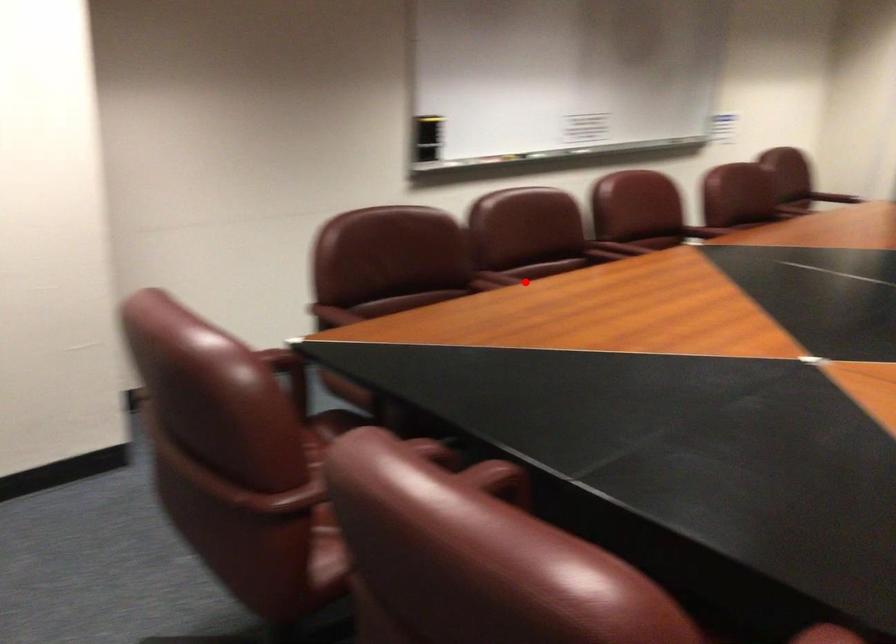
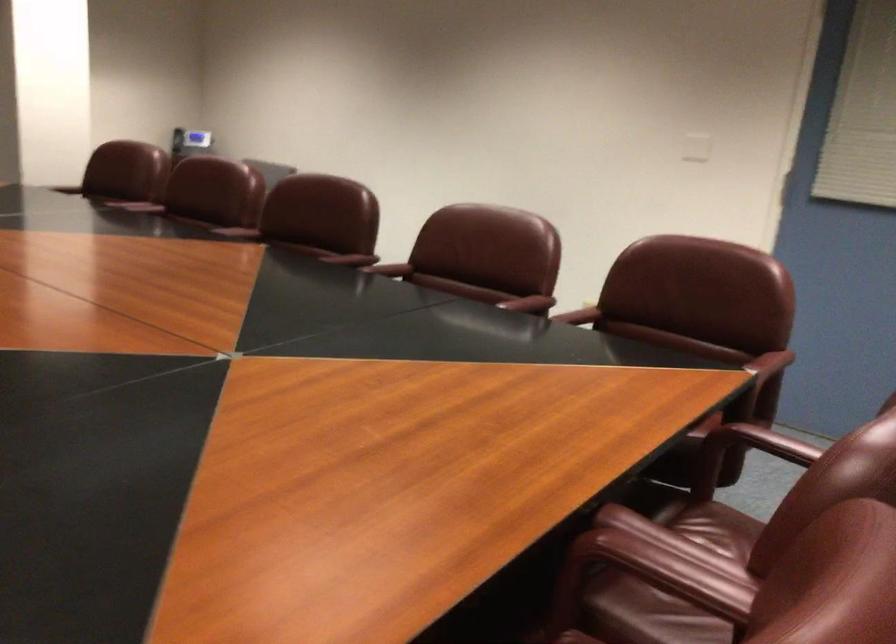
Question: I am providing you with two images of the same scene from different viewpoints. A red point is shown in image1. For the corresponding object point in image2, is it positioned nearer or farther from the camera?

Choices:
 (A) Nearer
 (B) Farther

Answer: (A)